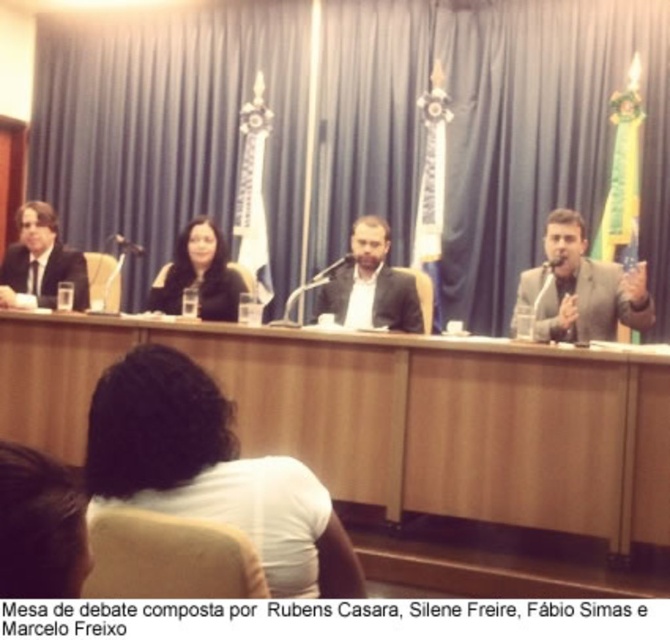
Who is shorter, wooden table at center or white fabric shirt at center?

white fabric shirt at center

Who is more distant from viewer, (239, 410) or (127, 403)?

The point (239, 410) is more distant.

Does point (600, 368) come behind point (291, 513)?

That is True.

Image resolution: width=670 pixels, height=640 pixels. Identify the location of wooden table at center. (401, 426).

Between gray suit at right and matte black jacket at center, which one is positioned lower?

gray suit at right

Between gray suit at right and matte black jacket at center, which one appears on the right side from the viewer's perspective?

From the viewer's perspective, gray suit at right appears more on the right side.

What do you see at coordinates (580, 289) in the screenshot?
I see `gray suit at right` at bounding box center [580, 289].

This screenshot has width=670, height=640. What are the coordinates of `gray suit at right` in the screenshot? It's located at (580, 289).

From the picture: Can you confirm if gray suit at right is bigger than matte black suit at left?

No, gray suit at right is not bigger than matte black suit at left.

This screenshot has width=670, height=640. What are the coordinates of `gray suit at right` in the screenshot? It's located at (580, 289).